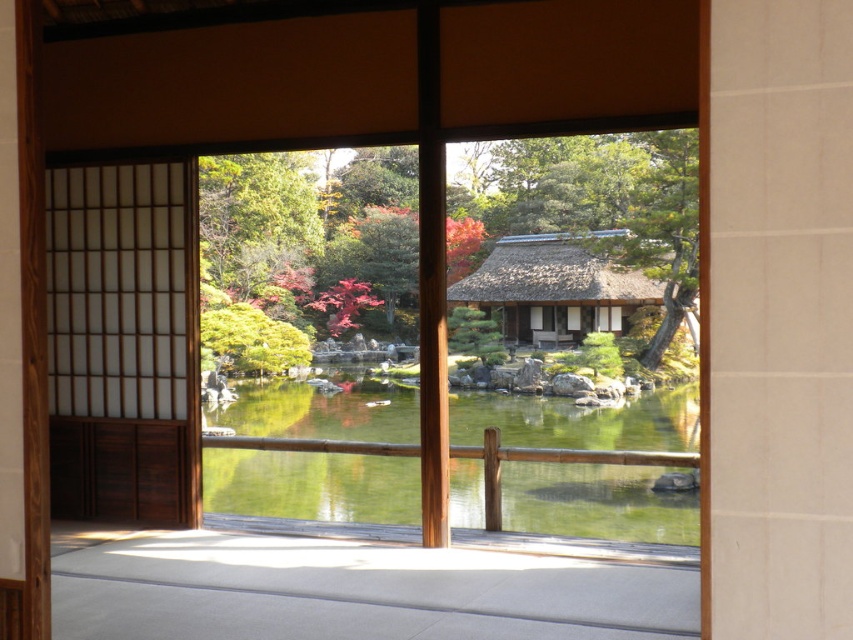
Is green reflective water at center positioned at the back of wooden shoji screen at left?

No, green reflective water at center is closer to the viewer.

Does green reflective water at center have a greater width compared to wooden shoji screen at left?

Yes.

Where is `green reflective water at center`? green reflective water at center is located at coordinates (315, 452).

Find the location of a particular element. This screenshot has width=853, height=640. green reflective water at center is located at coordinates (315, 452).